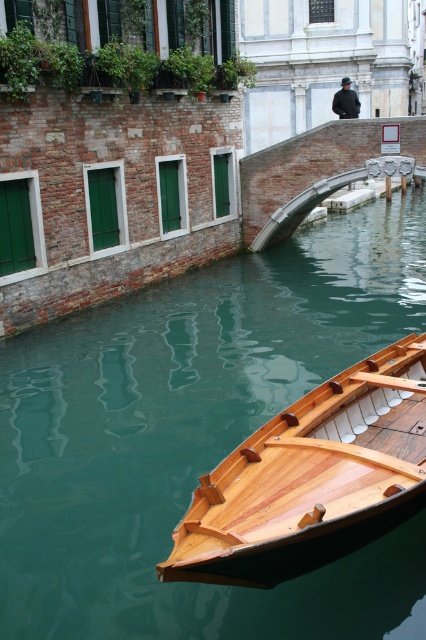
Between green smooth water at lower left and shiny brown wood boat at lower right, which one is positioned lower?

Positioned lower is shiny brown wood boat at lower right.

Is green smooth water at lower left bigger than shiny brown wood boat at lower right?

Yes.

Between point (271, 595) and point (270, 465), which one is positioned behind?

Point (270, 465)

This screenshot has width=426, height=640. What are the coordinates of `green smooth water at lower left` in the screenshot? It's located at (196, 436).